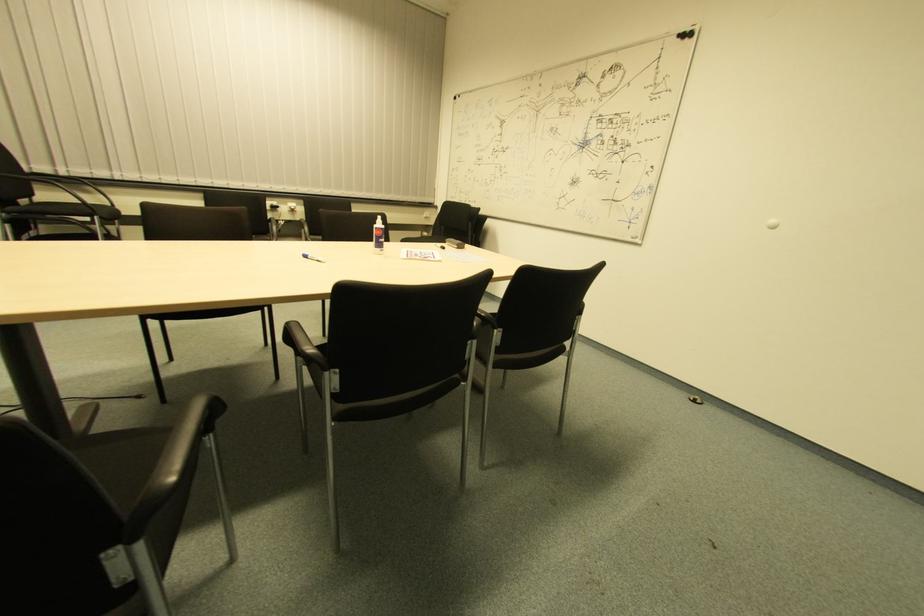
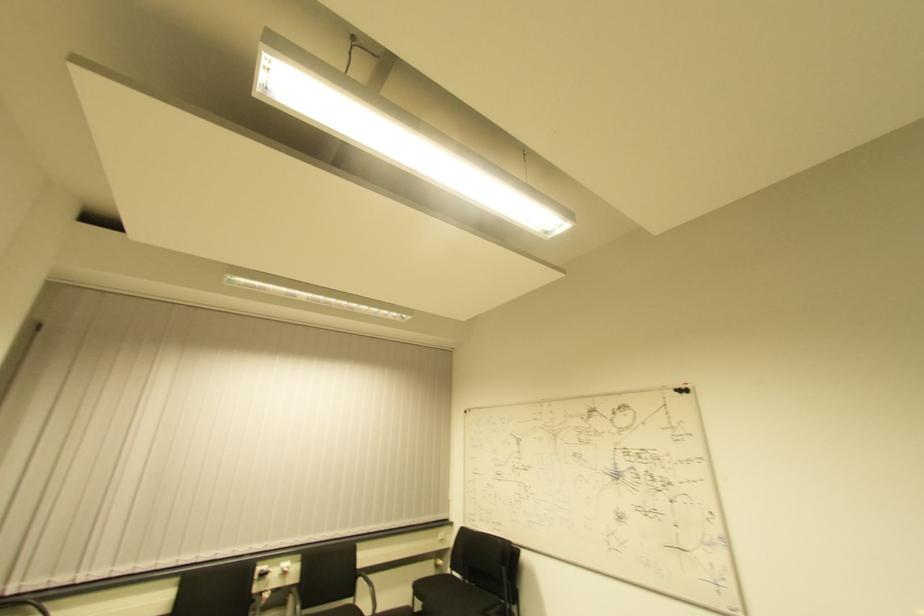
In the second image, find the point that corresponds to [434,209] in the first image.

(450, 527)